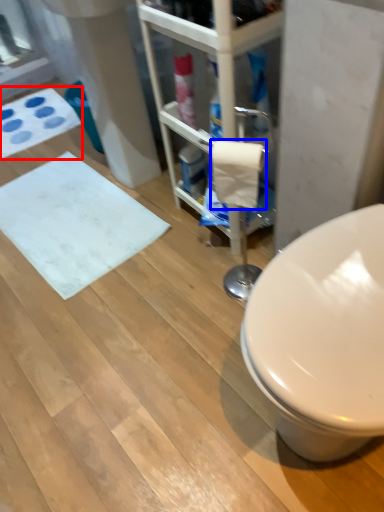
Question: Which object is closer to the camera taking this photo, bath mat (highlighted by a red box) or toilet paper (highlighted by a blue box)?

Choices:
 (A) bath mat
 (B) toilet paper

Answer: (B)